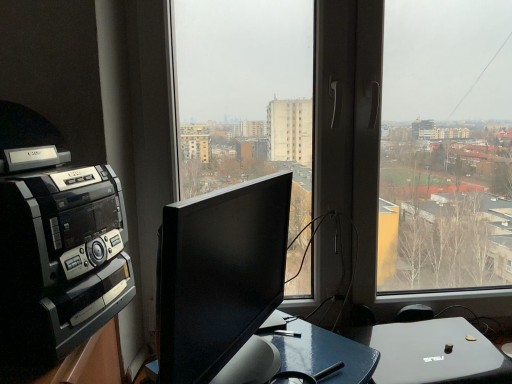
Question: From a real-world perspective, is black glossy monitor at center positioned over black plastic amplifier at left based on gravity?

Choices:
 (A) no
 (B) yes

Answer: (A)

Question: Does black glossy monitor at center have a greater width compared to black plastic amplifier at left?

Choices:
 (A) no
 (B) yes

Answer: (A)

Question: Does black glossy monitor at center have a greater height compared to black plastic amplifier at left?

Choices:
 (A) no
 (B) yes

Answer: (A)

Question: Does black glossy monitor at center have a lesser height compared to black plastic amplifier at left?

Choices:
 (A) yes
 (B) no

Answer: (A)

Question: Does black glossy monitor at center lie behind black plastic amplifier at left?

Choices:
 (A) yes
 (B) no

Answer: (B)

Question: Is black glossy monitor at center at the left side of black plastic amplifier at left?

Choices:
 (A) yes
 (B) no

Answer: (B)

Question: Is black glossy monitor at center positioned in front of transparent glass window at center?

Choices:
 (A) yes
 (B) no

Answer: (A)

Question: Is black glossy monitor at center oriented towards transparent glass window at center?

Choices:
 (A) yes
 (B) no

Answer: (B)

Question: From a real-world perspective, is black glossy monitor at center located higher than transparent glass window at center?

Choices:
 (A) yes
 (B) no

Answer: (B)

Question: Are black glossy monitor at center and transparent glass window at center beside each other?

Choices:
 (A) yes
 (B) no

Answer: (B)

Question: From the image's perspective, does black glossy monitor at center appear lower than transparent glass window at center?

Choices:
 (A) no
 (B) yes

Answer: (B)

Question: From the image's perspective, is black glossy monitor at center over transparent glass window at center?

Choices:
 (A) yes
 (B) no

Answer: (B)

Question: From a real-world perspective, is black plastic amplifier at left located beneath black glossy monitor at center?

Choices:
 (A) no
 (B) yes

Answer: (A)